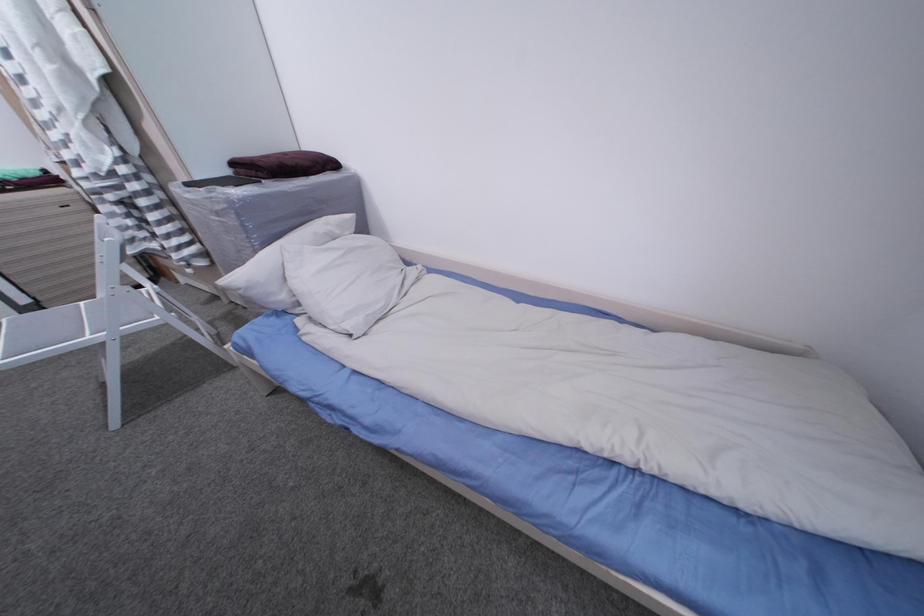
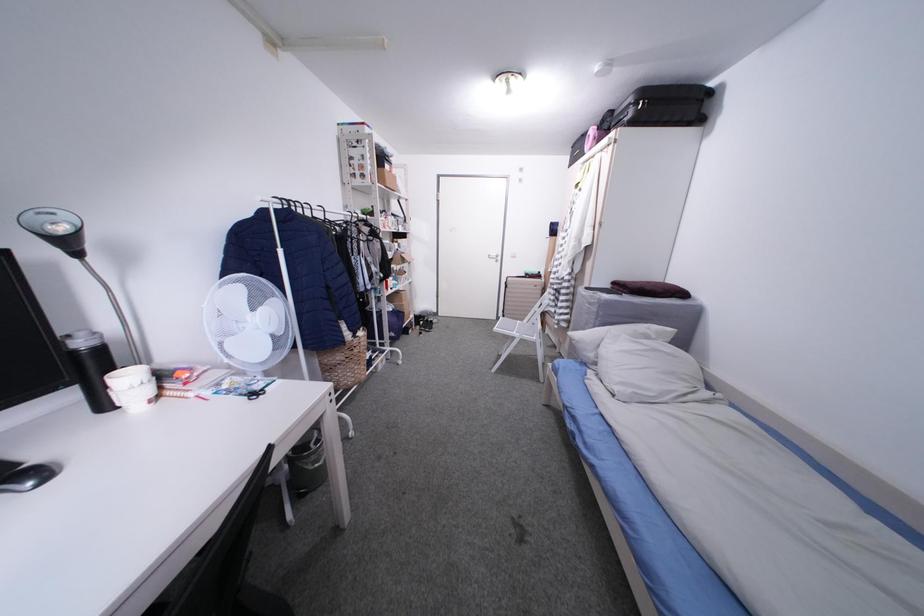
Question: The camera is either moving clockwise (left) or counter-clockwise (right) around the object. The first image is from the beginning of the video and the second image is from the end. Is the camera moving left or right when shooting the video?

Choices:
 (A) Left
 (B) Right

Answer: (B)